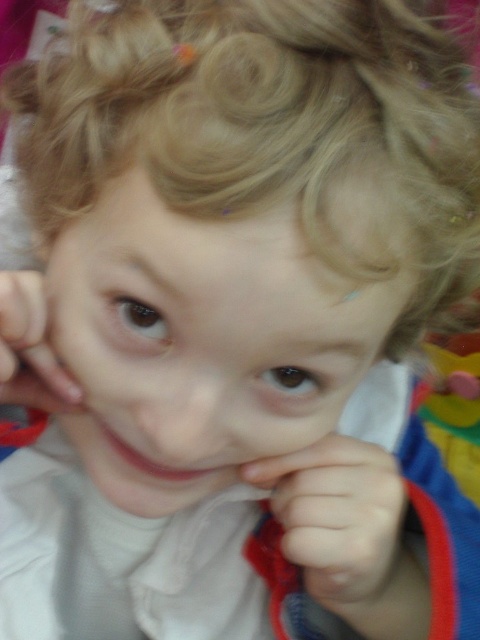
You are observing a child in an outdoor setting. You notice two hands belonging to the child, the smooth skin hand at center and the smooth skin hand at left. Which hand is closer to the right side of the child?

The smooth skin hand at center is positioned on the right side of the smooth skin hand at left, so it is closer to the child.